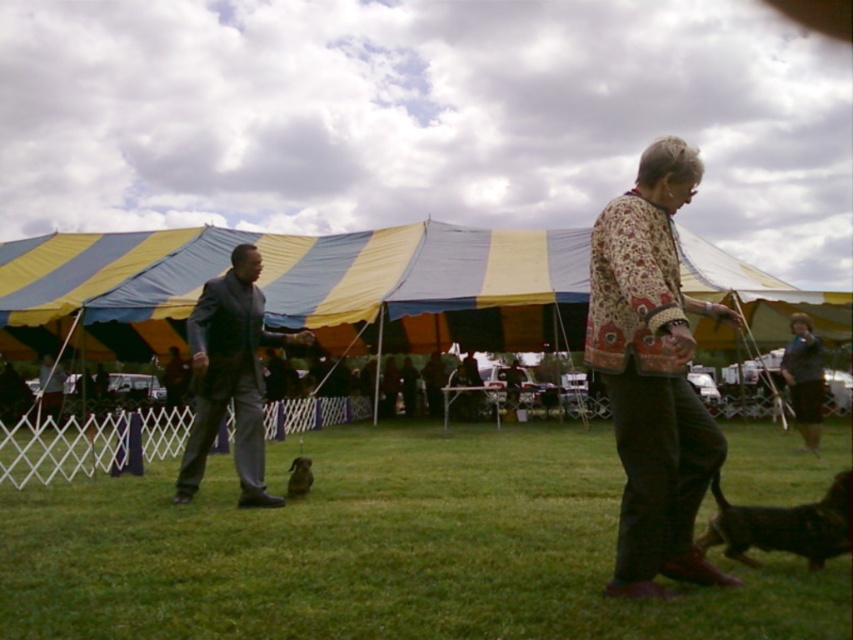
Looking at this image, who is shorter, green grass at center or brown fur dog at lower right?

Standing shorter between the two is green grass at center.

Does green grass at center have a lesser height compared to brown fur dog at lower right?

Yes.

Is point (735, 616) positioned after point (723, 540)?

No, (735, 616) is closer to viewer.

Where is `green grass at center`? green grass at center is located at coordinates (378, 548).

Can you confirm if floral-patterned fabric at center is positioned to the left of dark gray suit at left?

Incorrect, floral-patterned fabric at center is not on the left side of dark gray suit at left.

Does floral-patterned fabric at center have a lesser width compared to dark gray suit at left?

Incorrect, floral-patterned fabric at center's width is not less than dark gray suit at left's.

Find the location of a particular element. Image resolution: width=853 pixels, height=640 pixels. floral-patterned fabric at center is located at coordinates (653, 372).

Between point (733, 436) and point (219, 360), which one is positioned in front?

Positioned in front is point (219, 360).

Between green grass at center and dark gray suit at left, which one has less height?

Standing shorter between the two is green grass at center.

You are a GUI agent. You are given a task and a screenshot of the screen. Output one action in this format:
    pyautogui.click(x=<x>, y=<y>)
    Task: Click on the green grass at center
    
    Given the screenshot: What is the action you would take?
    pyautogui.click(x=378, y=548)